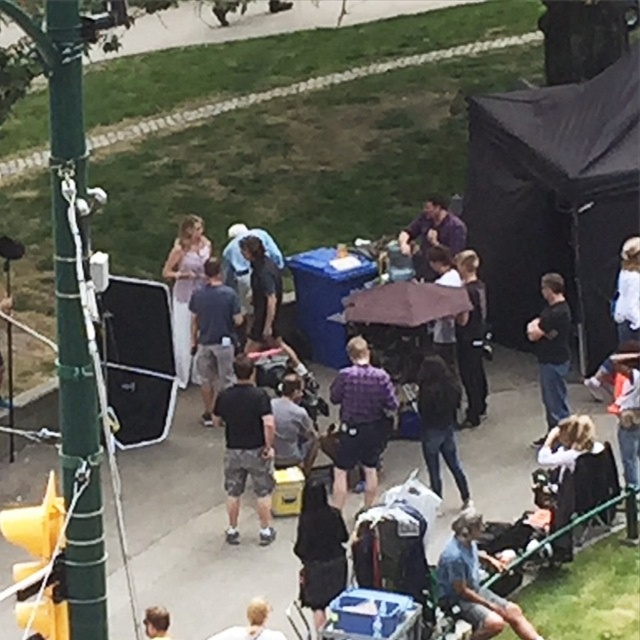
You are a costume designer observing the scene. You need to determine which of the two crew members at center has a shirt with a wider silhouette between the black matte shirt at center and the dark gray shirt at center based on the description provided. Which one is wider?

The black matte shirt at center might be wider than dark gray shirt at center according to the description provided.

You are an actor in this scene and need to locate your costume. You remember that your costume has a black matte shirt at center which is part of the outfit. Where would you find it relative to the dark gray shirt at center?

The black matte shirt at center is located below the dark gray shirt at center.

You are an actor standing at the edge of the set. You need to retrieve your script from the black matte shirt at center and then deliver a prop to the dark gray shirt at center. Given that you can walk 10 feet in 3 seconds, how long will it take you to complete both tasks?

The distance between the black matte shirt at center and dark gray shirt at center is 12.51 feet. To retrieve the script and deliver the prop, you must walk 12.51 feet to the black matte shirt at center, then return 12.51 feet back to the dark gray shirt at center, totaling 25.02 feet. At a rate of 10 feet per 3 seconds, this would take approximately 7.5 seconds.